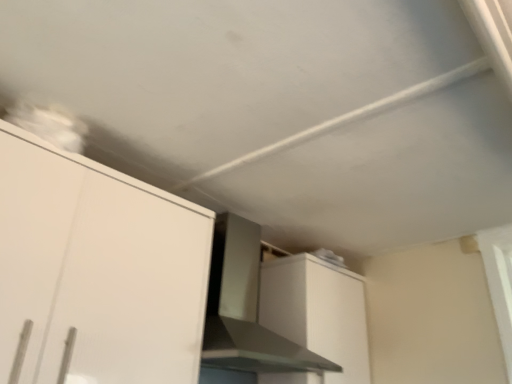
Question: Can you confirm if white matte cabinet at upper left, the first cabinetry in the left-to-right sequence, is taller than white matte cabinet at upper right, the first cabinetry positioned from the right?

Choices:
 (A) no
 (B) yes

Answer: (B)

Question: Can you confirm if white matte cabinet at upper left, which is counted as the second cabinetry, starting from the right, is thinner than white matte cabinet at upper right, the 1th cabinetry from the back?

Choices:
 (A) no
 (B) yes

Answer: (A)

Question: Considering the relative sizes of white matte cabinet at upper left, the first cabinetry in the left-to-right sequence, and white matte cabinet at upper right, which appears as the second cabinetry when viewed from the left, in the image provided, is white matte cabinet at upper left, the first cabinetry in the left-to-right sequence, smaller than white matte cabinet at upper right, which appears as the second cabinetry when viewed from the left,?

Choices:
 (A) no
 (B) yes

Answer: (A)

Question: Does white matte cabinet at upper left, which is counted as the first cabinetry, starting from the front, appear on the right side of white matte cabinet at upper right, the 1th cabinetry from the back?

Choices:
 (A) yes
 (B) no

Answer: (B)

Question: From a real-world perspective, is white matte cabinet at upper left, the first cabinetry in the left-to-right sequence, physically below white matte cabinet at upper right, the 1th cabinetry from the back?

Choices:
 (A) no
 (B) yes

Answer: (B)

Question: In terms of height, does satin silver vent at center look taller or shorter compared to white matte cabinet at upper right, which appears as the second cabinetry when viewed from the left?

Choices:
 (A) tall
 (B) short

Answer: (A)

Question: Is point (252, 306) positioned closer to the camera than point (300, 256)?

Choices:
 (A) farther
 (B) closer

Answer: (A)

Question: From a real-world perspective, relative to white matte cabinet at upper right, which appears as the second cabinetry when viewed from the left, is satin silver vent at center vertically above or below?

Choices:
 (A) below
 (B) above

Answer: (B)

Question: Which is correct: satin silver vent at center is inside white matte cabinet at upper right, arranged as the 2th cabinetry when viewed from the front, or outside of it?

Choices:
 (A) inside
 (B) outside

Answer: (B)

Question: Is point (163, 332) closer or farther from the camera than point (332, 370)?

Choices:
 (A) farther
 (B) closer

Answer: (B)

Question: Based on their positions, is white matte cabinet at upper left, which is counted as the second cabinetry, starting from the right, located to the left or right of satin silver vent at center?

Choices:
 (A) right
 (B) left

Answer: (B)

Question: Is white matte cabinet at upper left, which is counted as the second cabinetry, starting from the right, wider or thinner than satin silver vent at center?

Choices:
 (A) thin
 (B) wide

Answer: (A)

Question: From their relative heights in the image, would you say white matte cabinet at upper left, the first cabinetry in the left-to-right sequence, is taller or shorter than satin silver vent at center?

Choices:
 (A) tall
 (B) short

Answer: (A)

Question: From a real-world perspective, is white matte cabinet at upper left, which is counted as the 2th cabinetry, starting from the back, positioned above or below white matte cabinet at upper right, the first cabinetry positioned from the right?

Choices:
 (A) below
 (B) above

Answer: (A)

Question: Do you think white matte cabinet at upper left, which is counted as the second cabinetry, starting from the right, is within white matte cabinet at upper right, arranged as the 2th cabinetry when viewed from the front, or outside of it?

Choices:
 (A) inside
 (B) outside

Answer: (B)